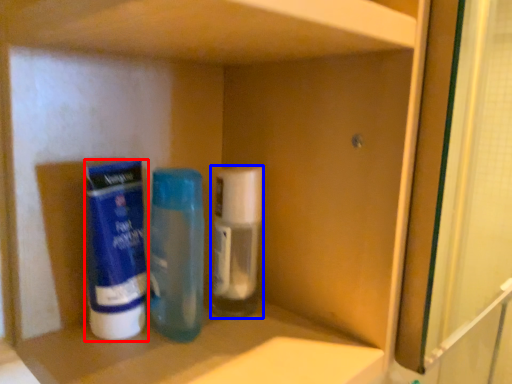
Question: Which object is further to the camera taking this photo, cleaning product (highlighted by a red box) or bottle (highlighted by a blue box)?

Choices:
 (A) cleaning product
 (B) bottle

Answer: (B)